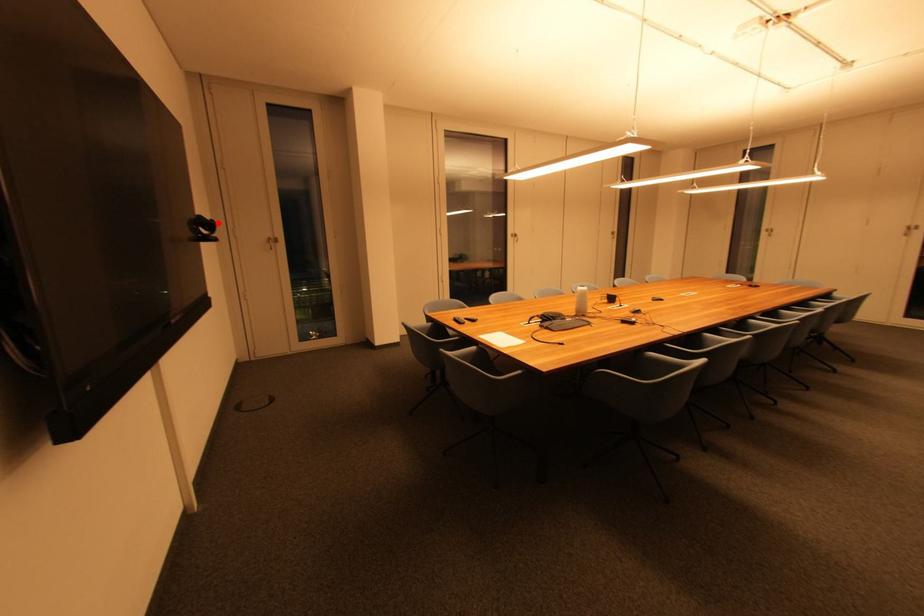
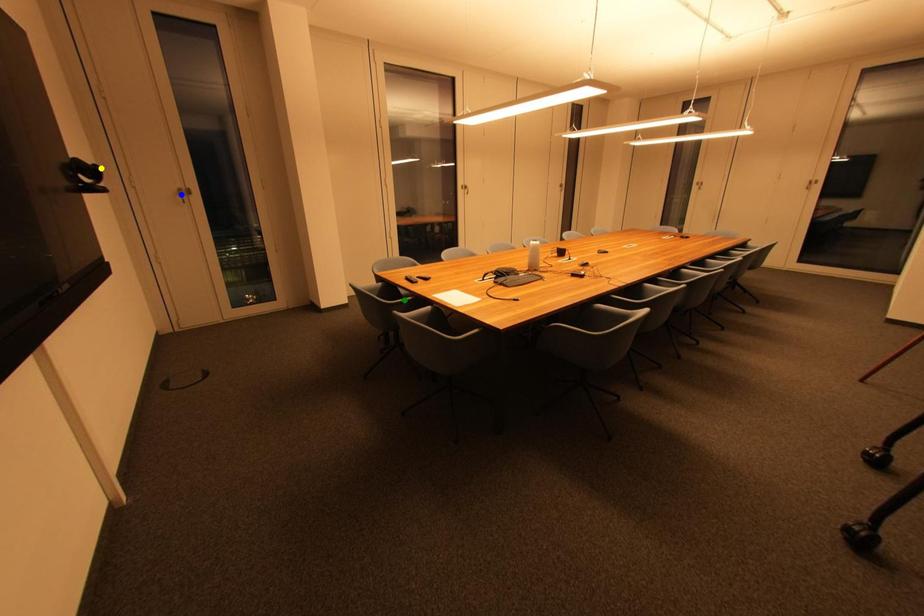
Question: I am providing you with two images of the same scene from different viewpoints. A red point is marked on the first image. You are given multiple points on the second image. Can you choose the point in image 2 that corresponds to the point in image 1?

Choices:
 (A) green point
 (B) yellow point
 (C) blue point

Answer: (B)